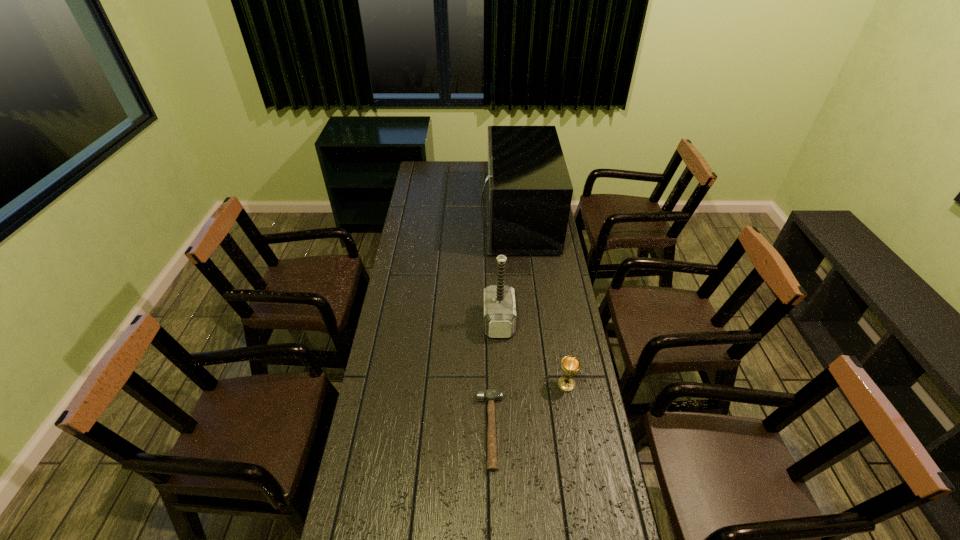
Find the location of a particular element. This screenshot has height=540, width=960. microwave oven is located at coordinates (528, 188).

You are a GUI agent. You are given a task and a screenshot of the screen. Output one action in this format:
    pyautogui.click(x=<x>, y=<y>)
    Task: Click on the second farthest object
    
    Given the screenshot: What is the action you would take?
    pyautogui.click(x=499, y=300)

Identify the location of the farther hammer. (499, 300).

Find the location of a particular element. The width and height of the screenshot is (960, 540). the third tallest object is located at coordinates (570, 365).

Identify the location of the shorter hammer. Image resolution: width=960 pixels, height=540 pixels. (490, 395).

Image resolution: width=960 pixels, height=540 pixels. I want to click on the shortest object, so (x=490, y=395).

What are the coordinates of `free space located with the door open on the farthest object` in the screenshot? It's located at (432, 220).

This screenshot has height=540, width=960. What are the coordinates of `vacant area situated with the door open on the farthest object` in the screenshot? It's located at (412, 220).

Image resolution: width=960 pixels, height=540 pixels. Find the location of `free region located with the door open on the farthest object`. free region located with the door open on the farthest object is located at coordinates (446, 220).

This screenshot has height=540, width=960. In order to click on vacant space positioned 0.060m for striking with the head of the second farthest object in this screenshot , I will do `click(468, 322)`.